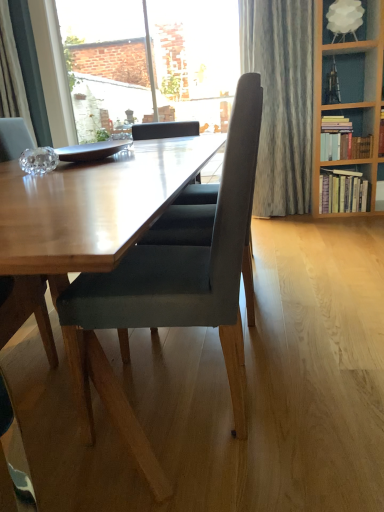
This screenshot has width=384, height=512. Identify the location of free spot to the right of velvet grey chair at center. (305, 400).